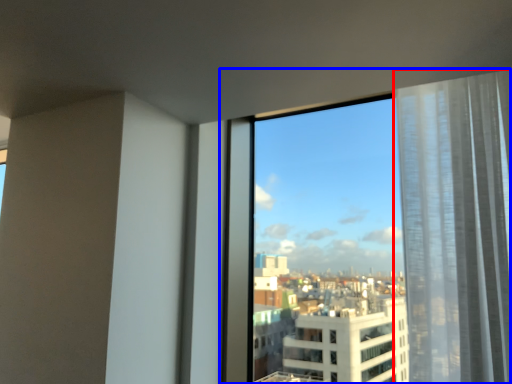
Question: Among these objects, which one is nearest to the camera, curtain (highlighted by a red box) or window (highlighted by a blue box)?

Choices:
 (A) curtain
 (B) window

Answer: (A)